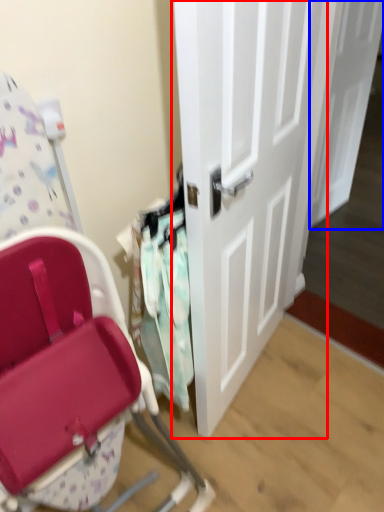
Question: Which point is closer to the camera, door (highlighted by a red box) or door (highlighted by a blue box)?

Choices:
 (A) door
 (B) door

Answer: (A)